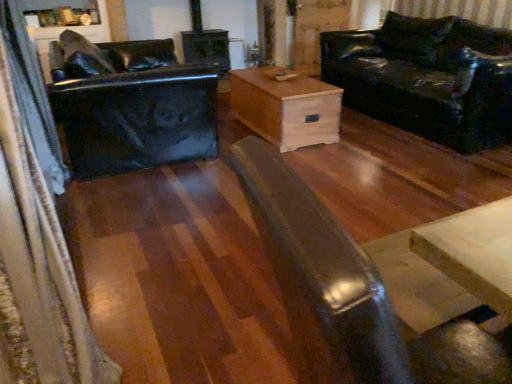
Question: Is glossy black swivel chair at left positioned with its back to matte black coffee table at center?

Choices:
 (A) yes
 (B) no

Answer: (B)

Question: Considering the relative sizes of glossy black swivel chair at left and matte black coffee table at center in the image provided, is glossy black swivel chair at left wider than matte black coffee table at center?

Choices:
 (A) no
 (B) yes

Answer: (B)

Question: From the image's perspective, is glossy black swivel chair at left above matte black coffee table at center?

Choices:
 (A) yes
 (B) no

Answer: (A)

Question: Would you say matte black coffee table at center is part of glossy black swivel chair at left's contents?

Choices:
 (A) no
 (B) yes

Answer: (A)

Question: From a real-world perspective, is glossy black swivel chair at left physically above matte black coffee table at center?

Choices:
 (A) no
 (B) yes

Answer: (A)

Question: Considering the positions of point coord(6,92) and point coord(317,112), is point coord(6,92) closer or farther from the camera than point coord(317,112)?

Choices:
 (A) farther
 (B) closer

Answer: (B)

Question: Considering the positions of velvet dark blue curtain at left and natural wood chest at center in the image, is velvet dark blue curtain at left wider or thinner than natural wood chest at center?

Choices:
 (A) thin
 (B) wide

Answer: (A)

Question: Considering their positions, is velvet dark blue curtain at left located in front of or behind natural wood chest at center?

Choices:
 (A) front
 (B) behind

Answer: (A)

Question: Would you say velvet dark blue curtain at left is to the left or to the right of natural wood chest at center in the picture?

Choices:
 (A) right
 (B) left

Answer: (B)

Question: Is point (292, 147) closer or farther from the camera than point (387, 322)?

Choices:
 (A) farther
 (B) closer

Answer: (A)

Question: From their relative heights in the image, would you say natural wood chest at center is taller or shorter than matte black coffee table at center?

Choices:
 (A) short
 (B) tall

Answer: (A)

Question: From a real-world perspective, is natural wood chest at center above or below matte black coffee table at center?

Choices:
 (A) below
 (B) above

Answer: (A)

Question: Which is correct: natural wood chest at center is inside matte black coffee table at center, or outside of it?

Choices:
 (A) outside
 (B) inside

Answer: (A)

Question: Is glossy black swivel chair at left taller or shorter than matte black coffee table at center?

Choices:
 (A) short
 (B) tall

Answer: (A)

Question: Is glossy black swivel chair at left in front of or behind matte black coffee table at center in the image?

Choices:
 (A) front
 (B) behind

Answer: (B)